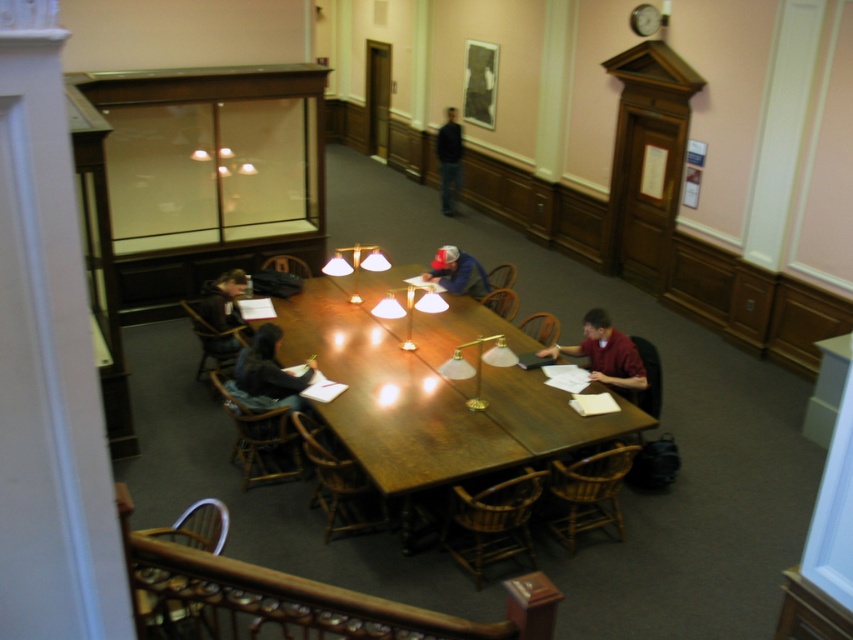
Question: Does wooden table at center appear on the left side of dark brown leather jacket at left?

Choices:
 (A) yes
 (B) no

Answer: (B)

Question: Which point is closer to the camera?

Choices:
 (A) (468, 257)
 (B) (646, 378)

Answer: (B)

Question: Which point is closer to the camera?

Choices:
 (A) (445, 205)
 (B) (225, 330)

Answer: (B)

Question: Which point appears farthest from the camera in this image?

Choices:
 (A) (582, 344)
 (B) (456, 444)
 (C) (437, 259)
 (D) (206, 321)

Answer: (C)

Question: Can you confirm if wooden table at center is positioned below matte red shirt at center?

Choices:
 (A) no
 (B) yes

Answer: (A)

Question: Is matte red shirt at center in front of dark blue jeans at center?

Choices:
 (A) yes
 (B) no

Answer: (A)